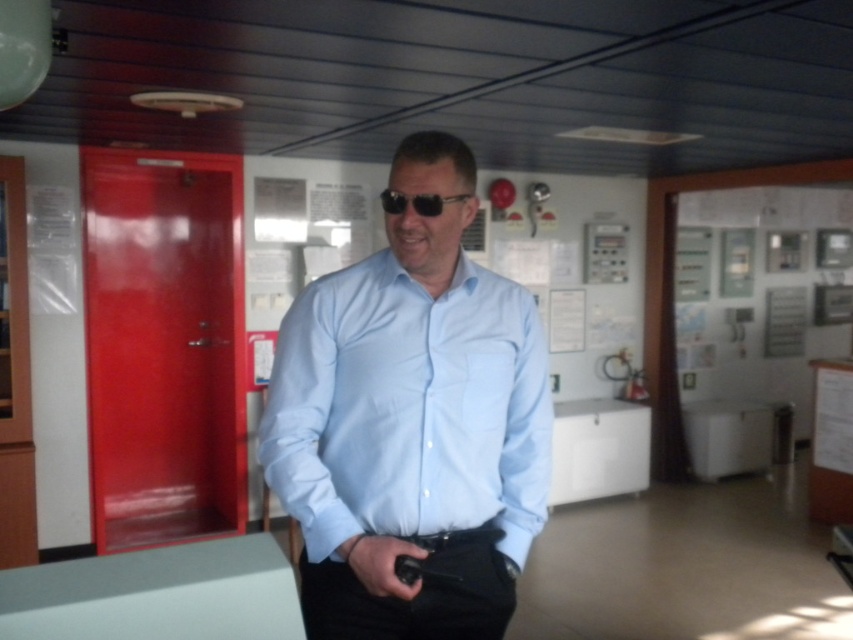
You are a crew member on a ship and need to locate your sunglasses and shirt. According to the scene, where is the light blue shirt at center in relation to the black plastic sunglasses at center?

The light blue shirt at center is below the black plastic sunglasses at center.

You are a security officer checking the equipment in this room. You see the black matte gun at lower center and the black plastic sunglasses at center. Which object is wider?

The black plastic sunglasses at center is wider than the black matte gun at lower center.

You are a security officer in the ship and you need to check the location of the light blue shirt at center and the black matte gun at lower center. According to the scene, which object is positioned higher?

The light blue shirt at center is located above the black matte gun at lower center, so the light blue shirt at center is positioned higher.